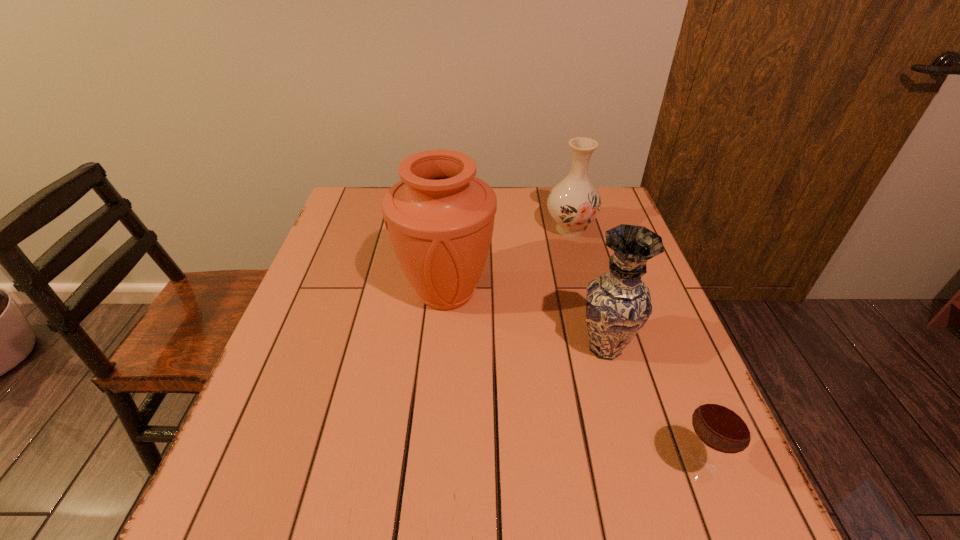
Identify the location of the closest vase to the farthest vase. (440, 217).

The image size is (960, 540). I want to click on free space that satisfies the following two spatial constraints: 1. on the front side of the leftmost object; 2. on the right side of the shortest object, so click(x=431, y=465).

Locate an element on the screen. This screenshot has height=540, width=960. vacant point that satisfies the following two spatial constraints: 1. on the front side of the farthest vase; 2. on the left side of the wineglass is located at coordinates (633, 465).